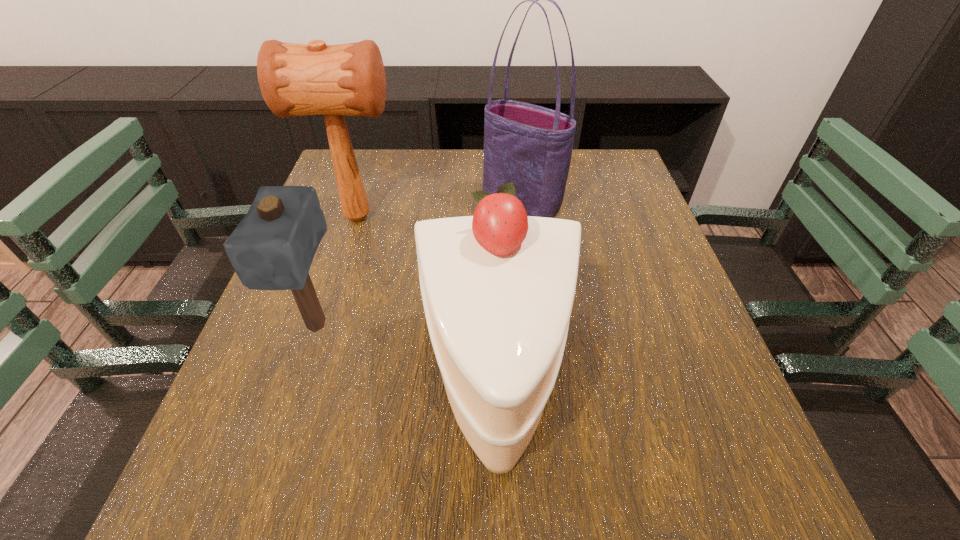
Where is `tote bag`? Image resolution: width=960 pixels, height=540 pixels. tote bag is located at coordinates (529, 145).

Find the location of a particular element. This screenshot has height=540, width=960. the farther mallet is located at coordinates (349, 79).

Image resolution: width=960 pixels, height=540 pixels. What are the coordinates of `cake` in the screenshot? It's located at (x=498, y=287).

At what (x,y) coordinates should I click in order to perform the action: click on the nearer mallet. Please return your answer as a coordinate pair (x, y). Looking at the image, I should click on (272, 248).

Where is `vacant space located 0.380m on the left of the tote bag`? This screenshot has width=960, height=540. vacant space located 0.380m on the left of the tote bag is located at coordinates (334, 203).

Where is `blank space located on the strike surface of the taller mallet`? Image resolution: width=960 pixels, height=540 pixels. blank space located on the strike surface of the taller mallet is located at coordinates (493, 217).

Where is `vacant area situated 0.250m on the left of the cake`? This screenshot has width=960, height=540. vacant area situated 0.250m on the left of the cake is located at coordinates (273, 383).

Image resolution: width=960 pixels, height=540 pixels. What are the coordinates of `vacant position located on the right of the nearer mallet` in the screenshot? It's located at (423, 326).

This screenshot has height=540, width=960. Find the location of `object positioned at the far edge`. object positioned at the far edge is located at coordinates (529, 145).

At what (x,y) coordinates should I click in order to perform the action: click on object present at the near edge. Please return your answer as a coordinate pair (x, y). The image size is (960, 540). Looking at the image, I should click on (498, 287).